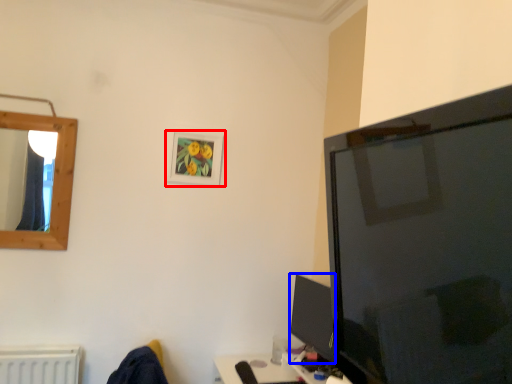
Question: Which object is further to the camera taking this photo, picture frame (highlighted by a red box) or tv show (highlighted by a blue box)?

Choices:
 (A) picture frame
 (B) tv show

Answer: (A)